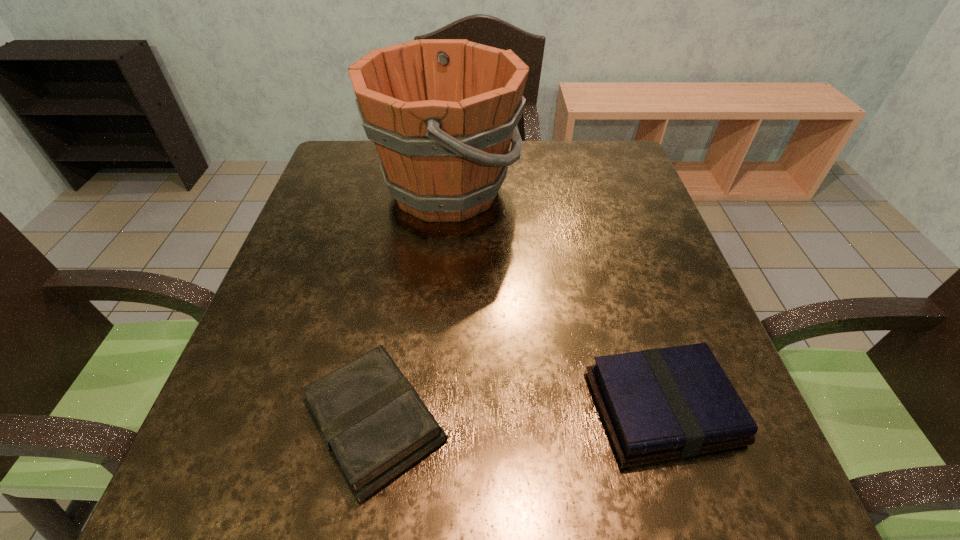
You are a GUI agent. You are given a task and a screenshot of the screen. Output one action in this format:
    pyautogui.click(x=<x>, y=<y>)
    Task: Click on the tallest object
    The width and height of the screenshot is (960, 540).
    Given the screenshot: What is the action you would take?
    pyautogui.click(x=442, y=113)

Where is `bucket`? Image resolution: width=960 pixels, height=540 pixels. bucket is located at coordinates (442, 113).

Identify the location of the right book. The width and height of the screenshot is (960, 540). (655, 405).

This screenshot has width=960, height=540. Find the location of `the left book`. the left book is located at coordinates (372, 421).

Locate an element on the screen. The height and width of the screenshot is (540, 960). vacant space located 0.080m on the handle side of the tallest object is located at coordinates (550, 191).

At what (x,y) coordinates should I click in order to perform the action: click on blank space located on the back of the right book. Please return your answer as a coordinate pair (x, y). This screenshot has height=540, width=960. Looking at the image, I should click on (630, 306).

Find the location of `vacant space located 0.110m on the left of the left book`. vacant space located 0.110m on the left of the left book is located at coordinates (231, 422).

The height and width of the screenshot is (540, 960). In order to click on object present at the far edge in this screenshot , I will do `click(442, 113)`.

This screenshot has width=960, height=540. Find the location of `bucket that is at the left edge`. bucket that is at the left edge is located at coordinates (442, 113).

The image size is (960, 540). I want to click on book positioned at the left edge, so (372, 421).